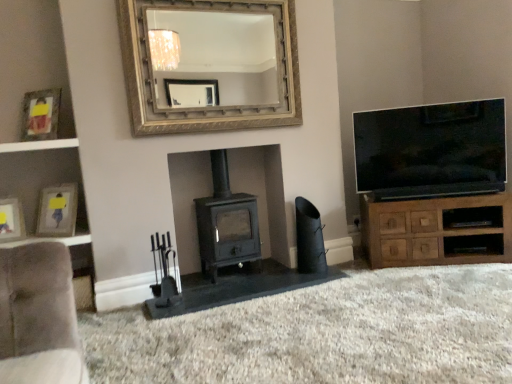
This screenshot has height=384, width=512. I want to click on free space in front of brown wood cabinet at right, so click(x=452, y=290).